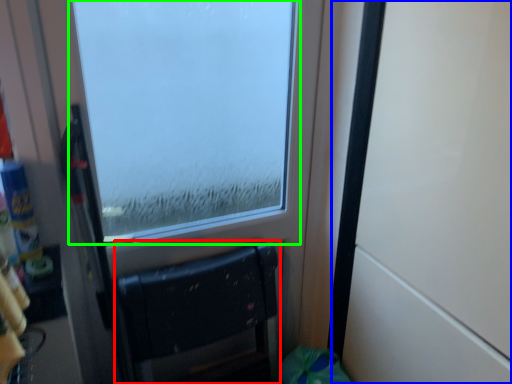
Question: Estimate the real-world distances between objects in this image. Which object is closer to furniture (highlighted by a red box), door (highlighted by a blue box) or window (highlighted by a green box)?

Choices:
 (A) door
 (B) window

Answer: (A)